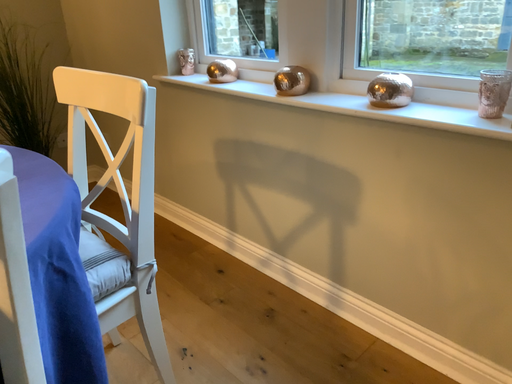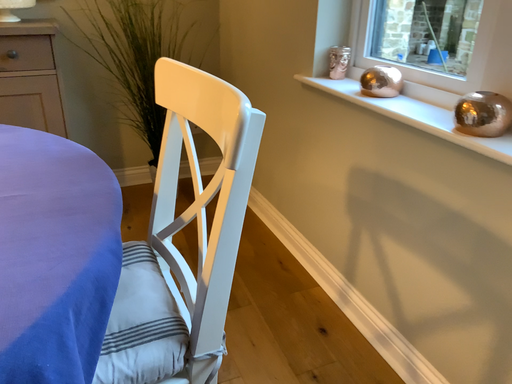
Question: Which way did the camera rotate in the video?

Choices:
 (A) rotated right
 (B) rotated left

Answer: (B)